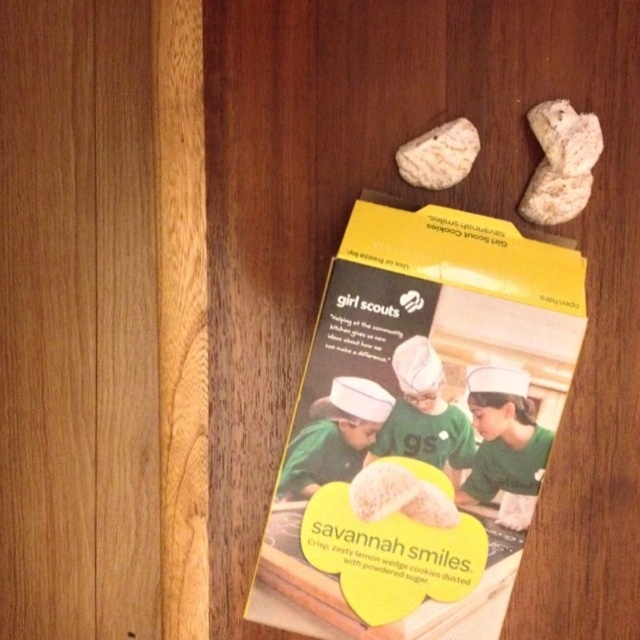
You are a baker who wants to place a decorative ribbon between the yellow paper girl scout cookie box at center and the white crumbly cookie at center. The ribbon is 6 inches long. Will the ribbon be long enough to stretch between them?

The distance between the yellow paper girl scout cookie box at center and the white crumbly cookie at center is 5.50 inches. Since the ribbon is 6 inches long, it will be long enough to stretch between them with a little extra length remaining.

You are a customer looking at the Girl Scout cookie package and see the baked white cookie at upper center and the smooth beige rock at upper right. Which object is located more to the left on the package?

The baked white cookie at upper center is more to the left than the smooth beige rock at upper right.